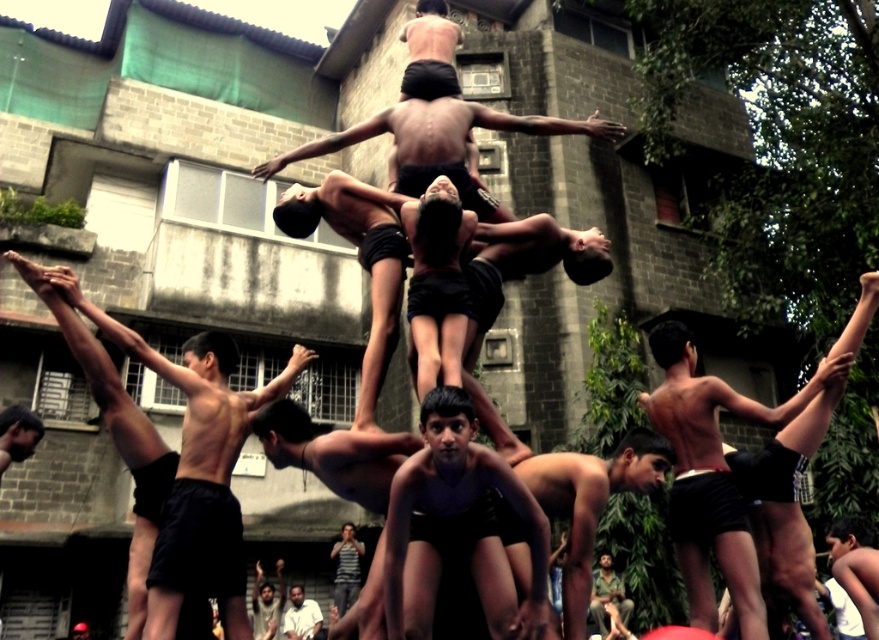
You are a photographer trying to capture the human pyramid from the front. You notice the brown leather jacket at lower center and the dark skin human at center are blocking your view. Which object should you move to get a clearer shot of the pyramid?

The brown leather jacket at lower center should be moved because it is bigger than the dark skin human at center, making it a larger obstruction.